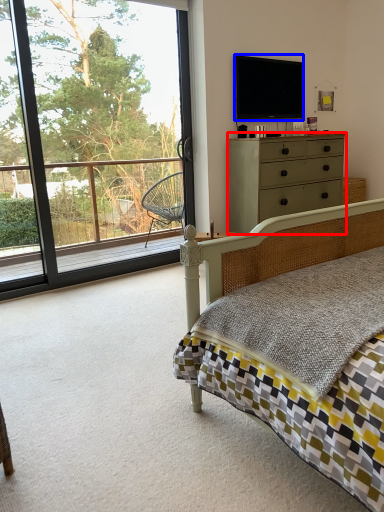
Question: Which of the following is the closest to the observer, chest of drawers (highlighted by a red box) or television (highlighted by a blue box)?

Choices:
 (A) chest of drawers
 (B) television

Answer: (A)